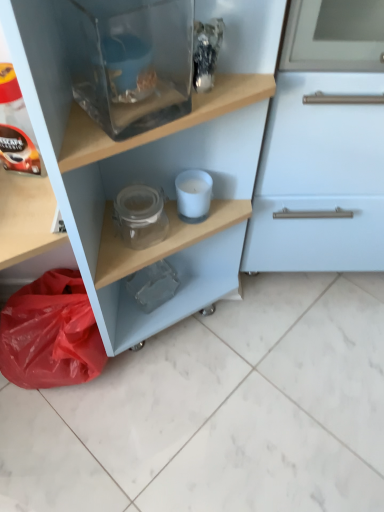
Question: Is transparent glass jar at upper center shorter than matte black coffee pod at left?

Choices:
 (A) no
 (B) yes

Answer: (A)

Question: Is transparent glass jar at upper center looking in the opposite direction of matte black coffee pod at left?

Choices:
 (A) yes
 (B) no

Answer: (A)

Question: Does transparent glass jar at upper center have a lesser width compared to matte black coffee pod at left?

Choices:
 (A) yes
 (B) no

Answer: (B)

Question: Is transparent glass jar at upper center positioned in front of matte black coffee pod at left?

Choices:
 (A) yes
 (B) no

Answer: (A)

Question: Would you consider transparent glass jar at upper center to be distant from matte black coffee pod at left?

Choices:
 (A) yes
 (B) no

Answer: (B)

Question: Is transparent glass jar at upper center at the left side of matte black coffee pod at left?

Choices:
 (A) no
 (B) yes

Answer: (A)

Question: Could transparent glass fish tank at upper center, the 2th appliance from the back, be considered to be inside white matte candle at center, the first appliance positioned from the bottom?

Choices:
 (A) yes
 (B) no

Answer: (B)

Question: Considering the relative sizes of white matte candle at center, the first appliance positioned from the bottom, and transparent glass fish tank at upper center, arranged as the 1th appliance when viewed from the top, in the image provided, is white matte candle at center, the first appliance positioned from the bottom, bigger than transparent glass fish tank at upper center, arranged as the 1th appliance when viewed from the top,?

Choices:
 (A) no
 (B) yes

Answer: (A)

Question: Is white matte candle at center, the first appliance positioned from the bottom, smaller than transparent glass fish tank at upper center, arranged as the 1th appliance when viewed from the top?

Choices:
 (A) no
 (B) yes

Answer: (B)

Question: Is white matte candle at center, acting as the second appliance starting from the top, positioned far away from transparent glass fish tank at upper center, the 2th appliance from the back?

Choices:
 (A) yes
 (B) no

Answer: (B)

Question: Is white matte candle at center, acting as the second appliance starting from the top, looking in the opposite direction of transparent glass fish tank at upper center, arranged as the 1th appliance when viewed from the top?

Choices:
 (A) yes
 (B) no

Answer: (B)

Question: Can you confirm if white matte candle at center, arranged as the 2th appliance when viewed from the front, is shorter than transparent glass fish tank at upper center, arranged as the 1th appliance when viewed from the front?

Choices:
 (A) yes
 (B) no

Answer: (A)

Question: Can you confirm if white matte candle at center, which appears as the 1th appliance when viewed from the back, is positioned to the right of red plastic bag at lower left?

Choices:
 (A) no
 (B) yes

Answer: (B)